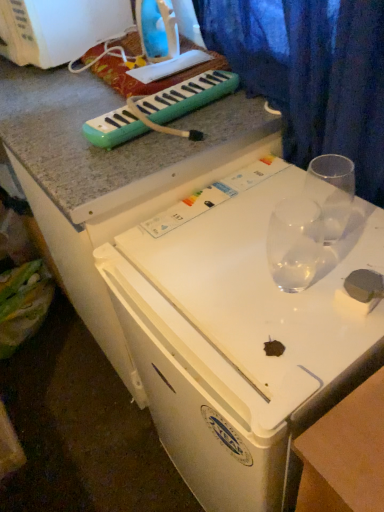
Locate an element on the screen. The width and height of the screenshot is (384, 512). unoccupied region to the right of clear glass martini glass at center, the 2th martini glass positioned from the right is located at coordinates click(346, 251).